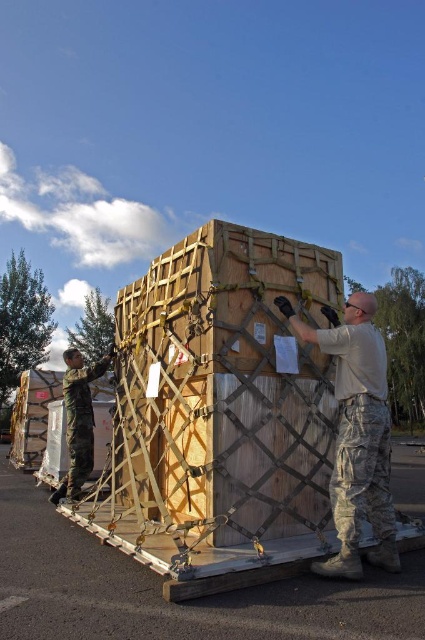
Does camouflage uniform at center have a greater height compared to camouflage uniform at left?

In fact, camouflage uniform at center may be shorter than camouflage uniform at left.

Does camouflage uniform at center come behind camouflage uniform at left?

That is False.

Which is in front, point (394, 572) or point (73, 387)?

Point (394, 572) is in front.

This screenshot has width=425, height=640. What are the coordinates of `camouflage uniform at center` in the screenshot? It's located at click(x=357, y=435).